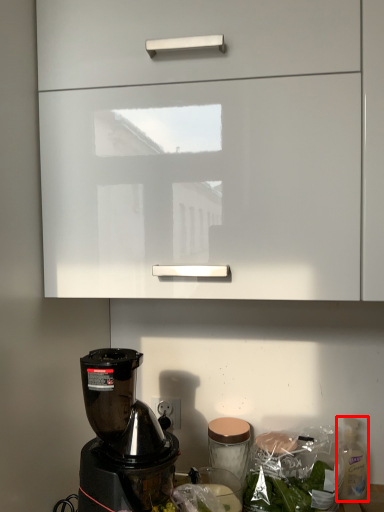
Question: Considering the relative positions of bottle (annotated by the red box) and cabinetry in the image provided, where is bottle (annotated by the red box) located with respect to the staircase?

Choices:
 (A) left
 (B) right

Answer: (B)